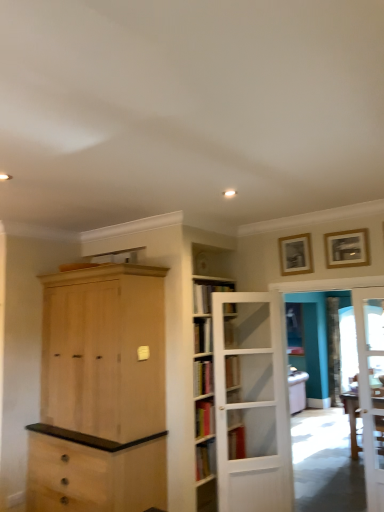
Question: From the image's perspective, is natural wood cabinet at center beneath gold wooden picture frame at upper right, the second picture frame viewed from the right?

Choices:
 (A) no
 (B) yes

Answer: (B)

Question: Is natural wood cabinet at center positioned beyond the bounds of gold wooden picture frame at upper right, the second picture frame viewed from the right?

Choices:
 (A) yes
 (B) no

Answer: (A)

Question: From a real-world perspective, is natural wood cabinet at center beneath gold wooden picture frame at upper right, which is counted as the 1th picture frame, starting from the back?

Choices:
 (A) yes
 (B) no

Answer: (A)

Question: From a real-world perspective, is natural wood cabinet at center on top of gold wooden picture frame at upper right, which is counted as the 1th picture frame, starting from the back?

Choices:
 (A) no
 (B) yes

Answer: (A)

Question: Could you tell me if natural wood cabinet at center is turned towards gold wooden picture frame at upper right, which is counted as the 1th picture frame, starting from the back?

Choices:
 (A) no
 (B) yes

Answer: (A)

Question: Is natural wood cabinet at center further to the viewer compared to gold wooden picture frame at upper right, the 1th picture frame positioned from the left?

Choices:
 (A) yes
 (B) no

Answer: (B)

Question: Would you say wooden table at right is a long distance from natural wood cabinet at center?

Choices:
 (A) no
 (B) yes

Answer: (B)

Question: Is wooden table at right at the left side of natural wood cabinet at center?

Choices:
 (A) yes
 (B) no

Answer: (B)

Question: Does wooden table at right appear on the right side of natural wood cabinet at center?

Choices:
 (A) yes
 (B) no

Answer: (A)

Question: Is natural wood cabinet at center located within wooden table at right?

Choices:
 (A) yes
 (B) no

Answer: (B)

Question: Is wooden table at right outside of natural wood cabinet at center?

Choices:
 (A) no
 (B) yes

Answer: (B)

Question: Can you confirm if wooden table at right is taller than natural wood cabinet at center?

Choices:
 (A) yes
 (B) no

Answer: (B)

Question: From the image's perspective, is white wooden door at center, the first door when ordered from left to right, located beneath hardcover book at center?

Choices:
 (A) no
 (B) yes

Answer: (B)